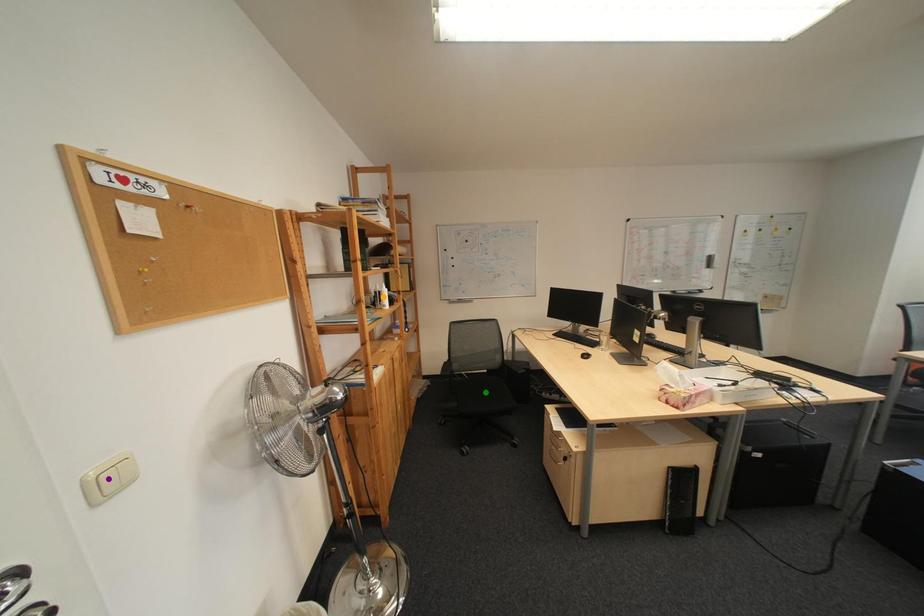
Order these from nearest to farthest:
1. purple point
2. green point
3. orange point

purple point
orange point
green point